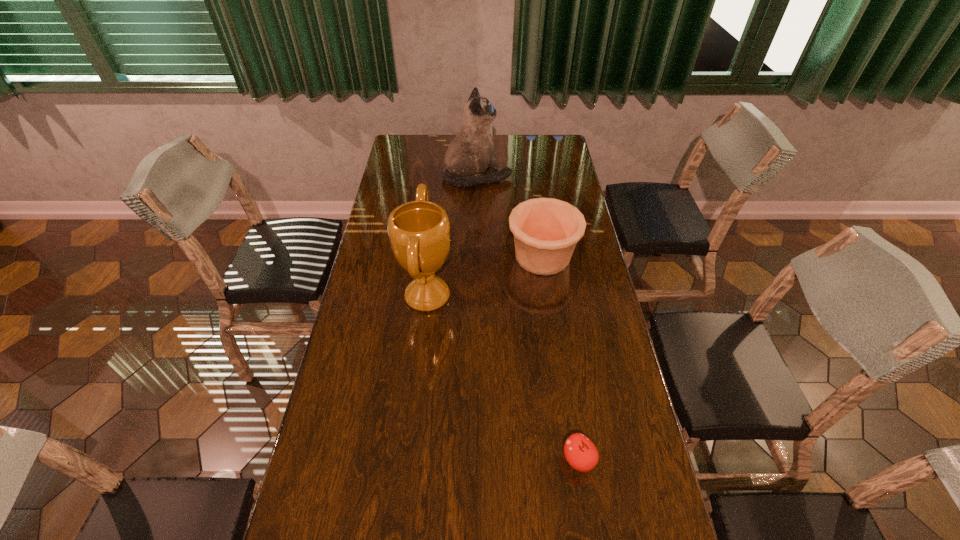
Select which object appears as the second closest to the award. Please provide its 2D coordinates. Your answer should be formatted as a tuple, i.e. [(x, y)], where the tuple contains the x and y coordinates of a point satisfying the conditions above.

[(472, 151)]

Find the location of a particular element. This screenshot has height=540, width=960. the closest object to the award is located at coordinates (546, 230).

I want to click on blank area in the image that satisfies the following two spatial constraints: 1. at the face of the cat; 2. on the right side of the shortest object, so click(474, 459).

The height and width of the screenshot is (540, 960). Identify the location of free space that satisfies the following two spatial constraints: 1. on the back side of the pottery; 2. at the face of the cat. pyautogui.click(x=531, y=177).

Locate an element on the screen. Image resolution: width=960 pixels, height=540 pixels. vacant space that satisfies the following two spatial constraints: 1. on the front of the award with the decoration; 2. on the right side of the nearest object is located at coordinates 410,459.

Identify the location of free point that satisfies the following two spatial constraints: 1. at the face of the farthest object; 2. on the left side of the second shortest object. coord(476,256).

This screenshot has width=960, height=540. Find the location of `vacant space that satisfies the following two spatial constraints: 1. on the front of the award with the decoration; 2. on the right side of the shortest object`. vacant space that satisfies the following two spatial constraints: 1. on the front of the award with the decoration; 2. on the right side of the shortest object is located at coordinates (410, 459).